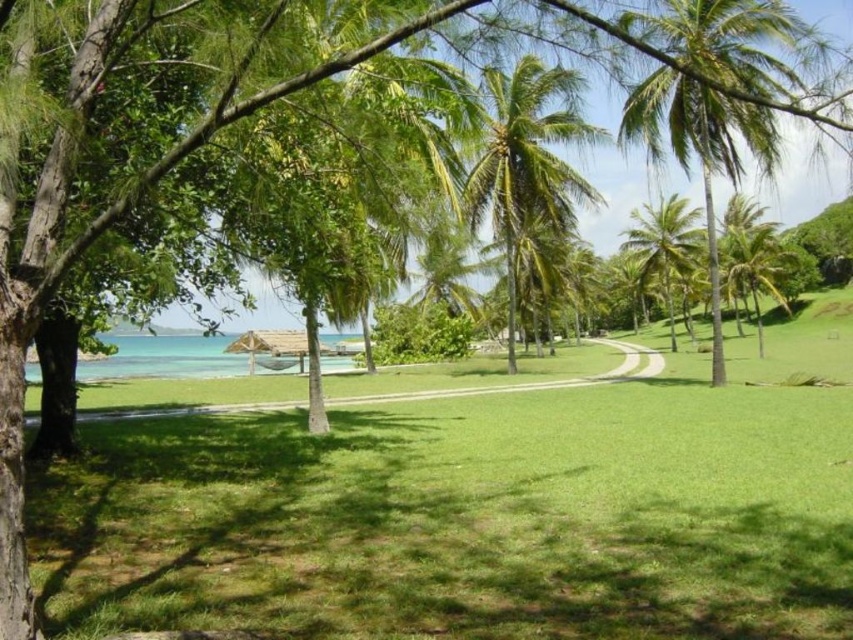
From the picture: You are standing at the thatched roof structure near the waterline and want to walk to the point marked as point (758,51). Which direction should you go relative to point (679,273)?

Point (758,51) is in front of point (679,273), so you should walk towards the direction of point (758,51) which is in front of point (679,273).

You are a landscape architect designing a new tropical garden. You have to place a new statue between the green leafy palm tree at upper right and the clear blue water at lower left. Which side of the statue should face the thinner object?

The green leafy palm tree at upper right is thinner than the clear blue water at lower left. Therefore, the statue should face the green leafy palm tree at upper right since it is the thinner object.

Based on the photo, you are standing at the thatched roof structure near the waterline and want to walk to the point marked as point (573, 200). Which direction should you go relative to the point (97, 374)?

Since point (573, 200) is closer to the viewer than point (97, 374), you should walk towards the direction of the thatched roof structure, which is closer to you compared to the other point further away.